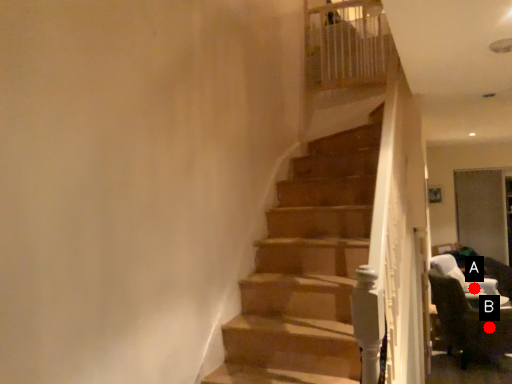
Question: Two points are circled on the image, labeled by A and B beside each circle. Which point is farther from the camera taking this photo?

Choices:
 (A) A is further
 (B) B is further

Answer: (A)